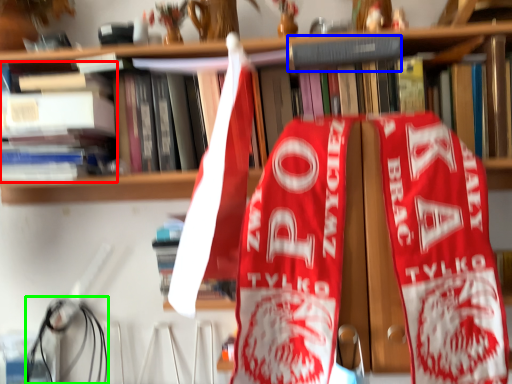
Question: Which object is positioned closest to book (highlighted by a red box)? Select from book (highlighted by a blue box) and wire (highlighted by a green box).

Choices:
 (A) book
 (B) wire

Answer: (B)